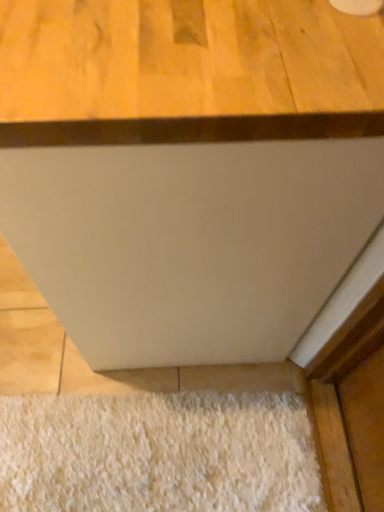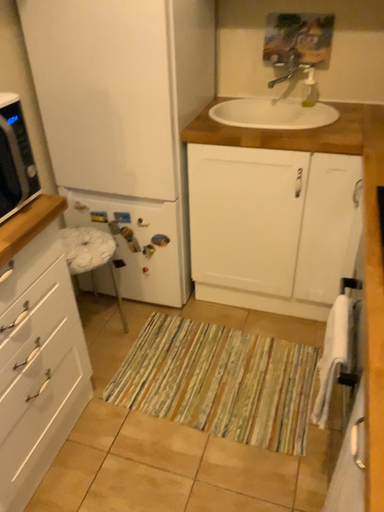
Question: How did the camera likely rotate when shooting the video?

Choices:
 (A) rotated downward
 (B) rotated upward

Answer: (B)